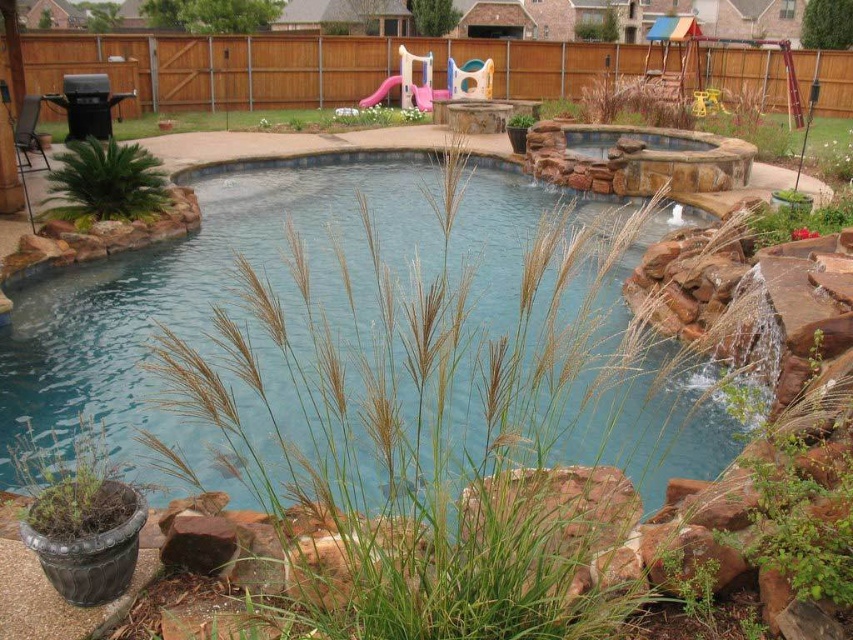
Question: Which point is closer to the camera taking this photo?

Choices:
 (A) (276, 262)
 (B) (526, 124)

Answer: (A)

Question: Which of the following is the closest to the observer?

Choices:
 (A) (527, 120)
 (B) (293, 435)

Answer: (B)

Question: Can you confirm if blue stone pond at center is wider than green leafy plant at upper left?

Choices:
 (A) no
 (B) yes

Answer: (B)

Question: Does green matte plant at lower left appear over green grass at upper center?

Choices:
 (A) yes
 (B) no

Answer: (B)

Question: Which object appears closest to the camera in this image?

Choices:
 (A) green leafy plant at upper center
 (B) green matte plant at lower left

Answer: (B)

Question: From the image, what is the correct spatial relationship of green leafy plant at upper left in relation to green leafy plant at upper center?

Choices:
 (A) above
 (B) below

Answer: (B)